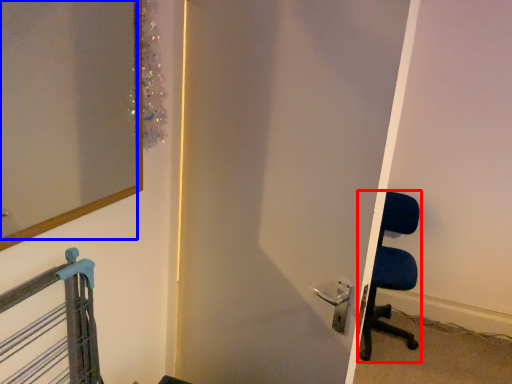
Question: Which object appears farthest to the camera in this image, chair (highlighted by a red box) or mirror (highlighted by a blue box)?

Choices:
 (A) chair
 (B) mirror

Answer: (A)